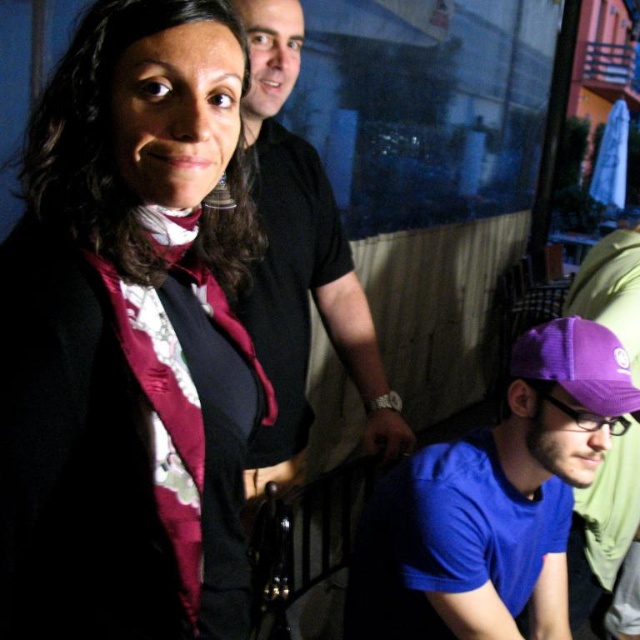
Is satin floral blouse at upper left bigger than purple fabric cap at lower right?

No, satin floral blouse at upper left is not bigger than purple fabric cap at lower right.

Does satin floral blouse at upper left have a greater height compared to purple fabric cap at lower right?

No.

Where is `satin floral blouse at upper left`? satin floral blouse at upper left is located at coordinates (128, 337).

Looking at this image, does black smooth shirt at upper center have a greater width compared to purple fabric cap at lower right?

Correct, the width of black smooth shirt at upper center exceeds that of purple fabric cap at lower right.

Who is positioned more to the right, black smooth shirt at upper center or purple fabric cap at lower right?

From the viewer's perspective, purple fabric cap at lower right appears more on the right side.

The image size is (640, 640). I want to click on black smooth shirt at upper center, so click(300, 264).

Locate an element on the screen. black smooth shirt at upper center is located at coordinates (300, 264).

Based on the photo, which is above, satin floral blouse at upper left or black smooth shirt at upper center?

black smooth shirt at upper center is higher up.

Which is in front, point (20, 620) or point (259, 484)?

Point (20, 620) is more forward.

This screenshot has height=640, width=640. What are the coordinates of `satin floral blouse at upper left` in the screenshot? It's located at (128, 337).